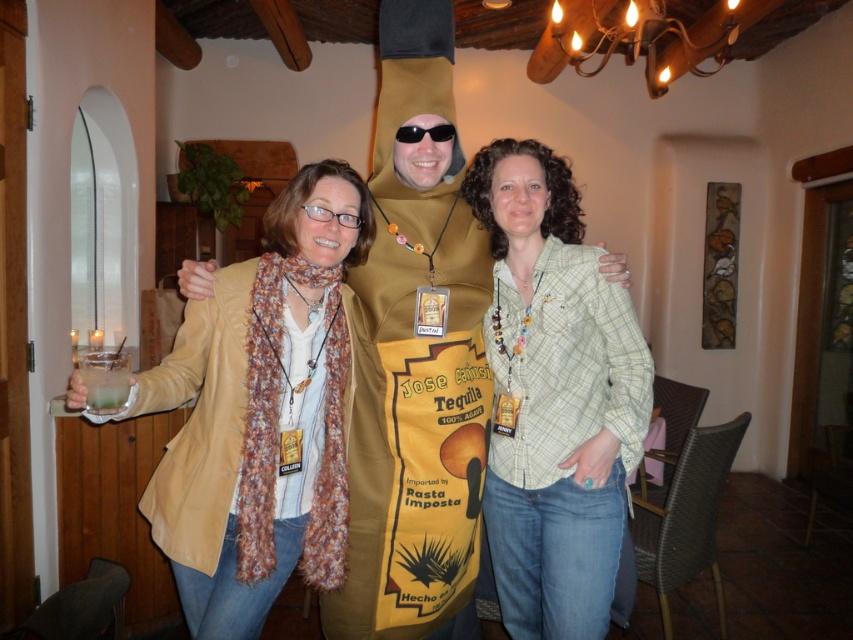
You are a photographer trying to capture a closeup of the beige textured scarf at center and the light green plaid shirt at center. Which one appears wider in the photo?

The beige textured scarf at center appears wider than the light green plaid shirt at center because its width surpasses that of the light green plaid shirt at center.